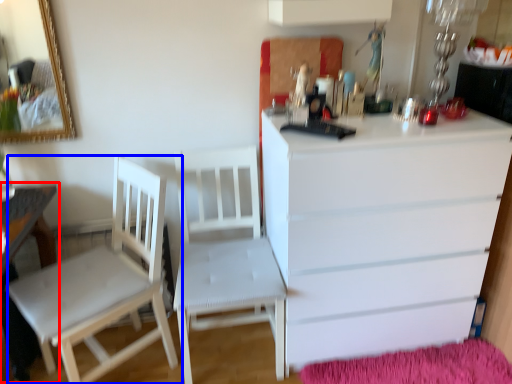
Question: Which point is further to the camera, table (highlighted by a red box) or chair (highlighted by a blue box)?

Choices:
 (A) table
 (B) chair

Answer: (B)